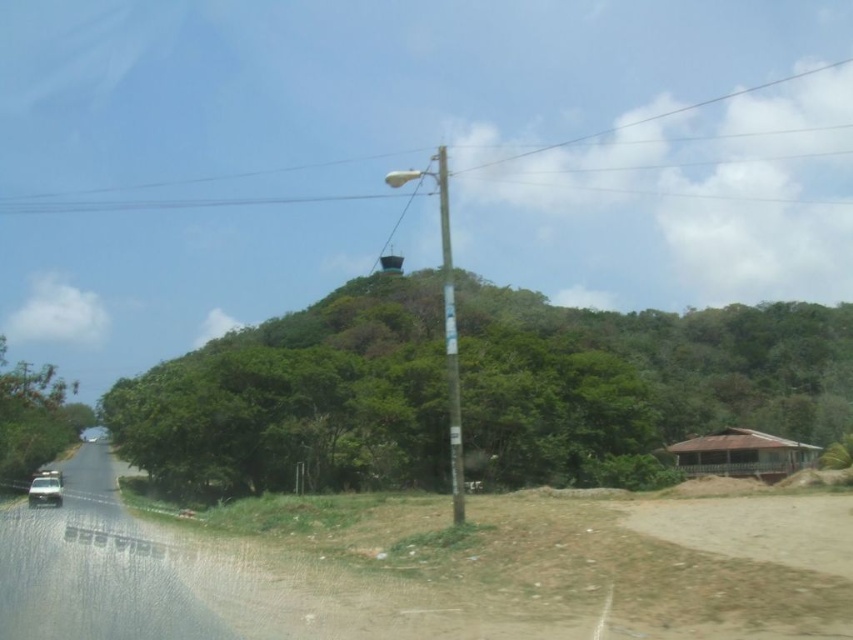
Question: Which is nearer to the green leafy tree at center?

Choices:
 (A) green painted wood pole at center
 (B) transparent glass car window at lower left
 (C) green leafy tree at left
 (D) white plastic power line at upper center

Answer: (A)

Question: Is green leafy tree at center above green leafy tree at left?

Choices:
 (A) yes
 (B) no

Answer: (A)

Question: Where is green leafy tree at left located in relation to green painted wood pole at center in the image?

Choices:
 (A) right
 (B) left

Answer: (B)

Question: Which object is positioned closest to the white plastic power line at upper center?

Choices:
 (A) green leafy tree at left
 (B) metallic silver car at lower left
 (C) green leafy tree at center
 (D) green painted wood pole at center

Answer: (D)

Question: Can you confirm if green leafy tree at left is positioned to the left of white plastic power line at upper center?

Choices:
 (A) yes
 (B) no

Answer: (A)

Question: Which of these objects is positioned closest to the green leafy tree at left?

Choices:
 (A) transparent glass car window at lower left
 (B) white plastic power line at upper center

Answer: (A)